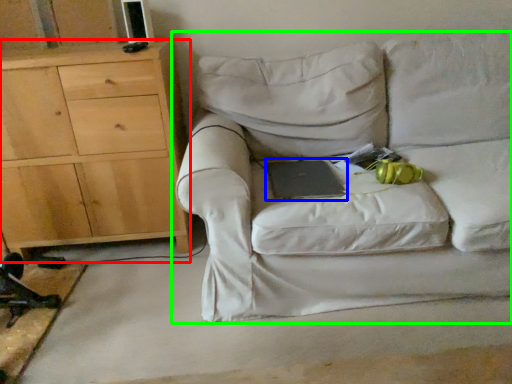
Question: Which object is positioned farthest from chest of drawers (highlighted by a red box)? Select from paperback book (highlighted by a blue box) and studio couch (highlighted by a green box).

Choices:
 (A) paperback book
 (B) studio couch

Answer: (A)